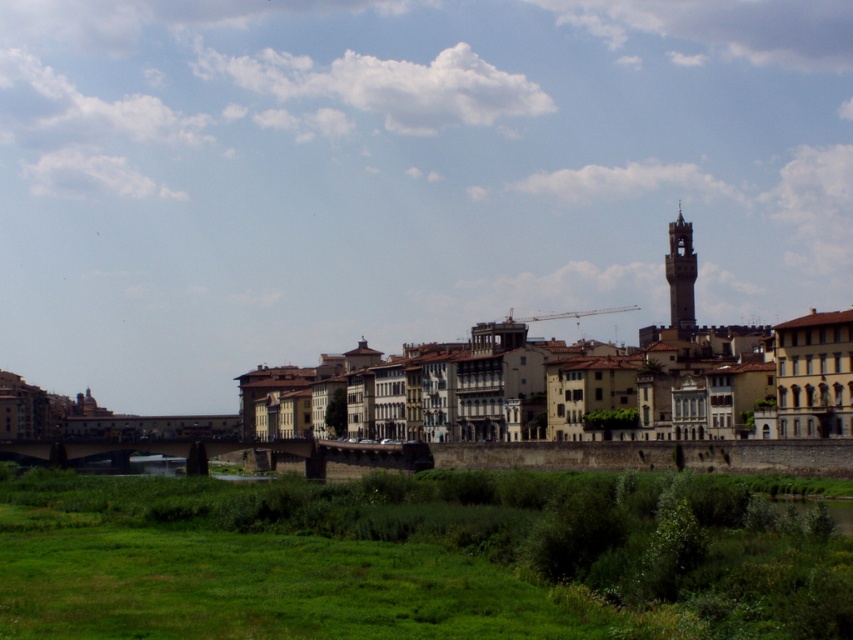
Question: Does green grassy at lower center have a greater width compared to concrete bridge at center?

Choices:
 (A) yes
 (B) no

Answer: (A)

Question: Estimate the real-world distances between objects in this image. Which object is closer to the green grassy at lower center?

Choices:
 (A) concrete bridge at center
 (B) dark gray stone clock tower at upper right

Answer: (A)

Question: Which point is closer to the camera?

Choices:
 (A) (149, 445)
 (B) (798, 582)

Answer: (B)

Question: Is the position of green grassy at lower center less distant than that of dark gray stone clock tower at upper right?

Choices:
 (A) no
 (B) yes

Answer: (B)

Question: Where is yellow stone buildings at center located in relation to dark gray stone clock tower at upper right in the image?

Choices:
 (A) right
 (B) left

Answer: (B)

Question: Which point is farther to the camera?

Choices:
 (A) (683, 316)
 (B) (294, 440)
 (C) (18, 420)

Answer: (C)